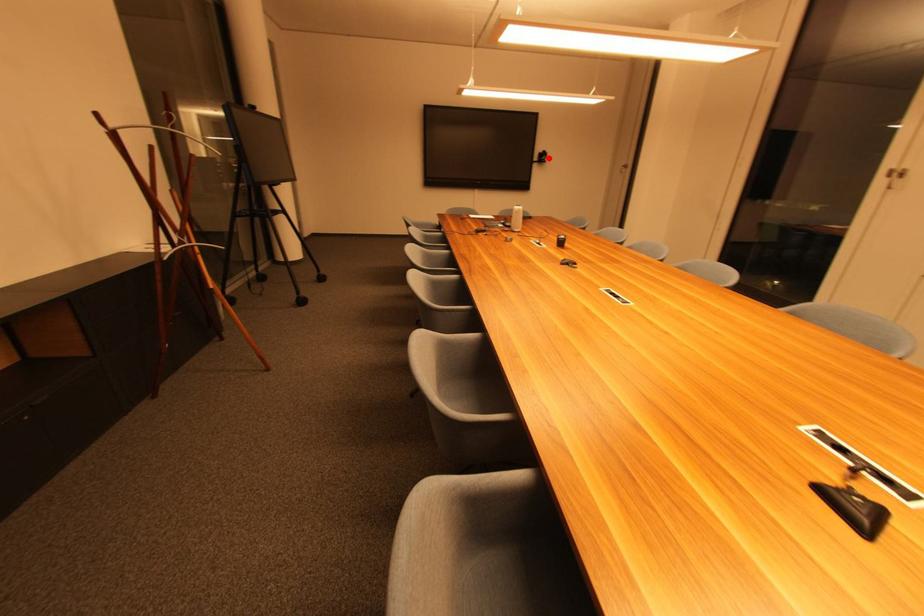
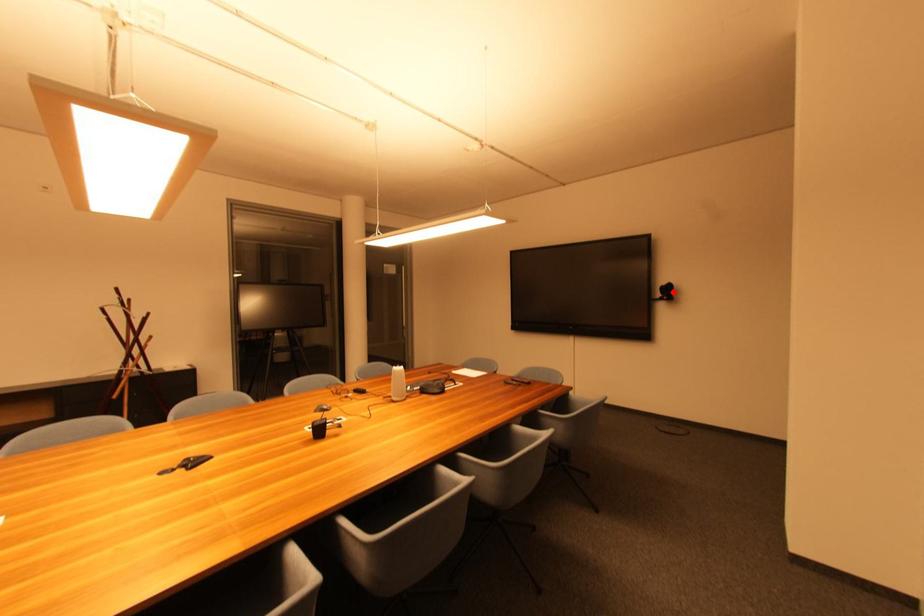
I am providing you with two images of the same scene from different viewpoints. A red point is marked on the first image and another point is marked on the second image. Is the marked point in image1 the same physical position as the marked point in image2?

Yes